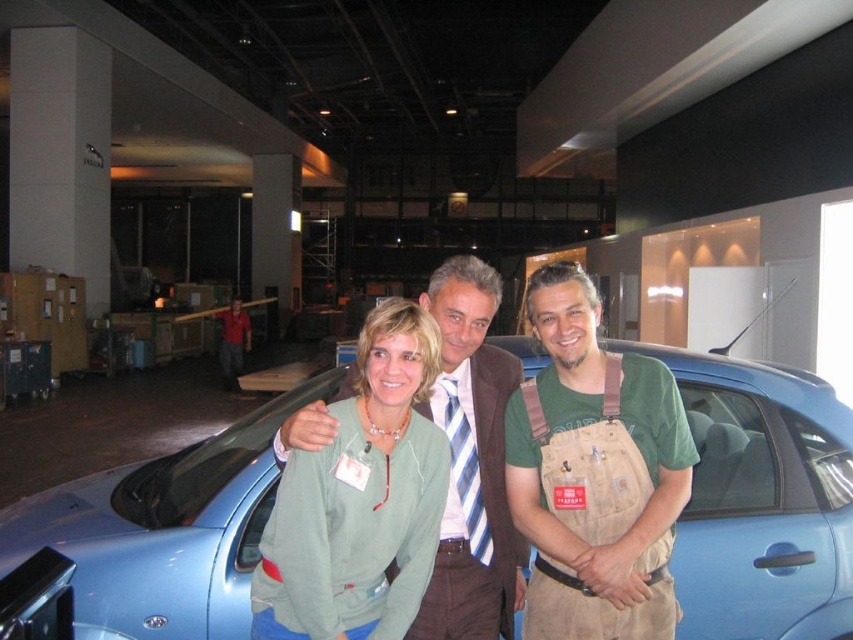
You are a tailor working in a fitting room and you have two garments at center, a green canvas overalls at center and a green cotton hoodie at center. You need to determine if they can be hung side by side on a hanger that is 5 inches wide. Can both garments fit on the hanger?

The distance between the green canvas overalls at center and green cotton hoodie at center is 2.45 inches. Since the hanger is 5 inches wide, both garments can be placed side by side as the combined width would be less than the hanger length.

You are a tailor measuring two green garments in the center of an image. The garments are the green canvas overalls at center and the green fabric jacket at center. Which garment is closer to the camera?

The green canvas overalls at center and green fabric jacket at center are 19.82 inches apart, so it is impossible to determine which is closer based solely on the distance between them.

You are standing in the showroom and want to walk from point A to point B. Point A is located at coordinate point (685, 476) and point B is at coordinate point (399, 504). Which direction should you move to get from point A to point B?

To move from point A to point B, you should move downward and to the right since point A is further to the viewer than point B, meaning it is closer to you. Moving towards point B would require going away from the viewer, which in coordinate terms translates to moving downward and rightward in the image.